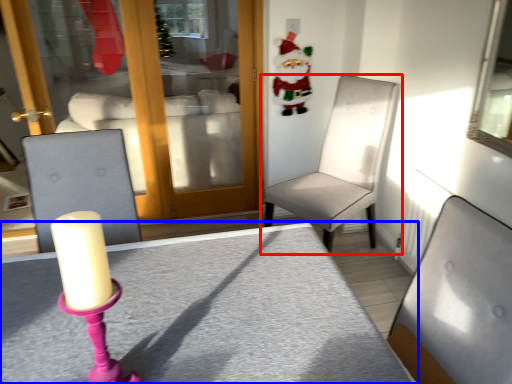
Question: Which object is closer to the camera taking this photo, chair (highlighted by a red box) or table (highlighted by a blue box)?

Choices:
 (A) chair
 (B) table

Answer: (B)